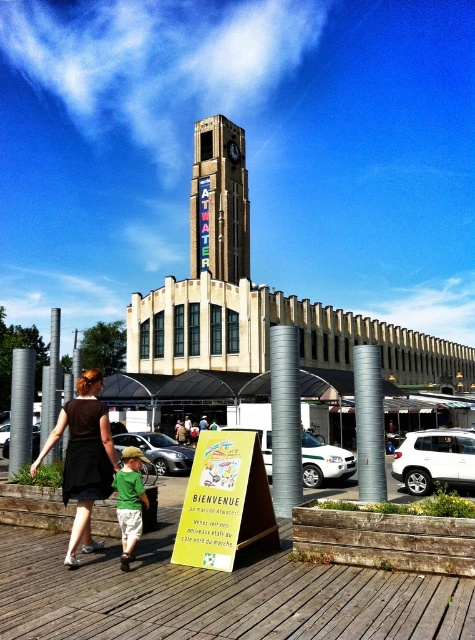
Question: Based on their relative distances, which object is farther from the matte concrete clock tower at center?

Choices:
 (A) matte black dress at center
 (B) metallic clock face at center
 (C) green cotton shirt at lower left

Answer: (C)

Question: In this image, where is matte black dress at center located relative to green cotton shirt at lower left?

Choices:
 (A) right
 (B) left

Answer: (B)

Question: Which point is closer to the camera?

Choices:
 (A) (241, 216)
 (B) (239, 156)
 (C) (83, 442)
 (D) (136, 502)

Answer: (D)

Question: Which point is closer to the camera?

Choices:
 (A) green cotton shirt at lower left
 (B) matte concrete clock tower at center
 (C) matte black dress at center
 (D) metallic clock face at center

Answer: (A)

Question: Is matte concrete clock tower at center further to camera compared to green cotton shirt at lower left?

Choices:
 (A) yes
 (B) no

Answer: (A)

Question: Does matte concrete clock tower at center have a larger size compared to metallic clock face at center?

Choices:
 (A) no
 (B) yes

Answer: (B)